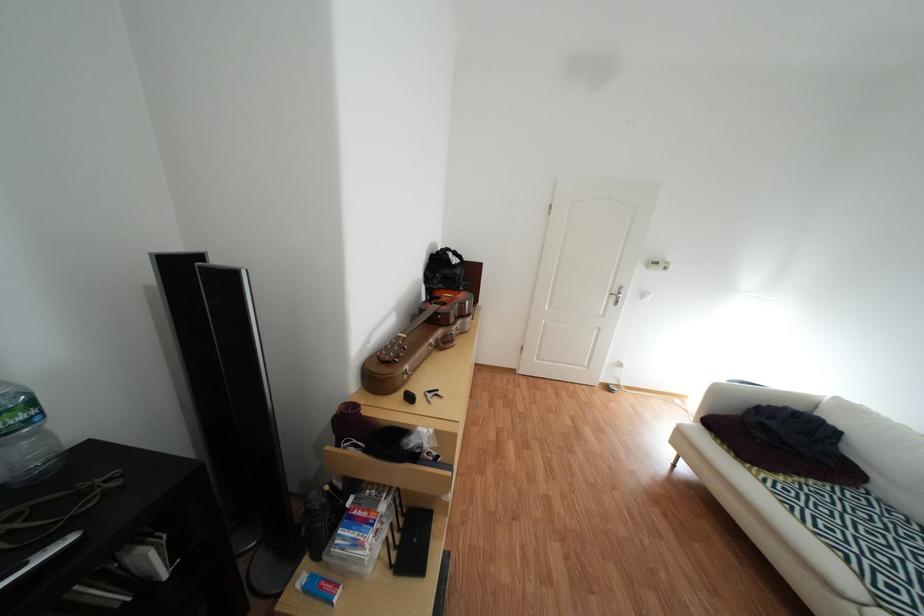
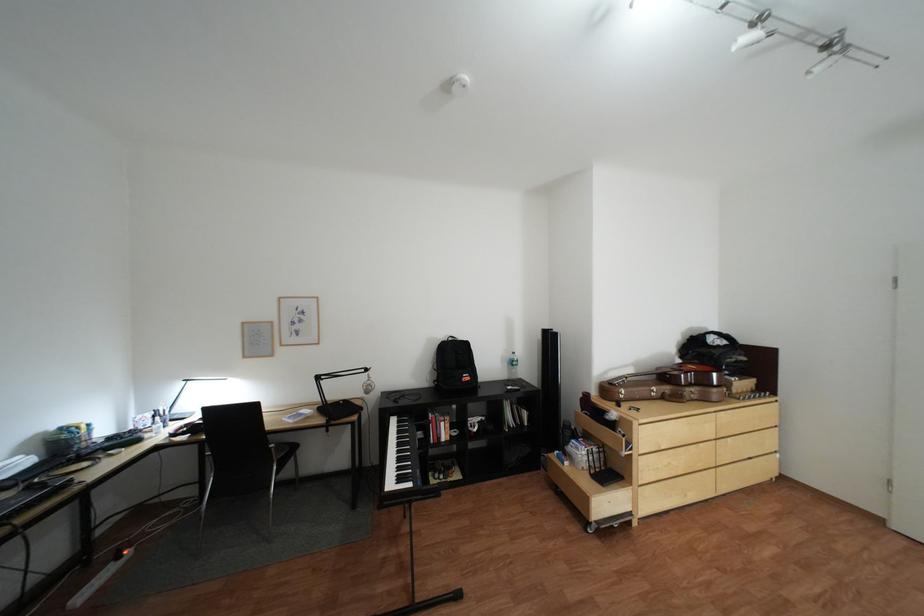
Where in the second image is the point corresponding to [469,328] from the first image?

(703, 391)